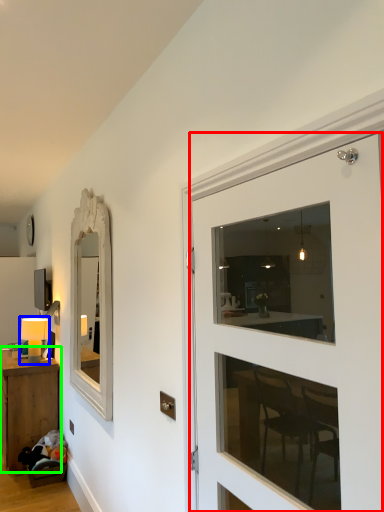
Question: Based on their relative distances, which object is nearer to door (highlighted by a red box)? Choose from table lamp (highlighted by a blue box) and table (highlighted by a green box).

Choices:
 (A) table lamp
 (B) table

Answer: (B)